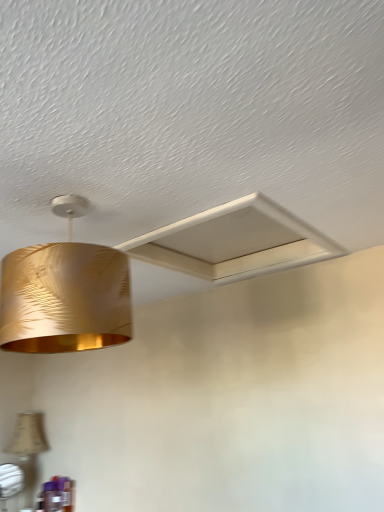
Question: Does white matte exhaust hood at upper center have a greater width compared to beige fabric lampshade at lower left, the first lamp ordered from the bottom?

Choices:
 (A) no
 (B) yes

Answer: (B)

Question: Is white matte exhaust hood at upper center facing towards beige fabric lampshade at lower left, which is the first lamp in back-to-front order?

Choices:
 (A) no
 (B) yes

Answer: (A)

Question: Is white matte exhaust hood at upper center directly adjacent to beige fabric lampshade at lower left, which is the first lamp in back-to-front order?

Choices:
 (A) yes
 (B) no

Answer: (B)

Question: Is white matte exhaust hood at upper center turned away from beige fabric lampshade at lower left, placed as the second lamp when sorted from top to bottom?

Choices:
 (A) yes
 (B) no

Answer: (B)

Question: Is white matte exhaust hood at upper center to the left of beige fabric lampshade at lower left, the first lamp ordered from the bottom, from the viewer's perspective?

Choices:
 (A) yes
 (B) no

Answer: (B)

Question: Is white matte exhaust hood at upper center bigger than beige fabric lampshade at lower left, which is the first lamp in back-to-front order?

Choices:
 (A) no
 (B) yes

Answer: (A)

Question: Is gold metallic lampshade at upper left, which appears as the 2th lamp when viewed from the left, further to the viewer compared to white matte exhaust hood at upper center?

Choices:
 (A) no
 (B) yes

Answer: (A)

Question: Can you confirm if gold metallic lampshade at upper left, the 1th lamp viewed from the right, is positioned to the right of white matte exhaust hood at upper center?

Choices:
 (A) yes
 (B) no

Answer: (B)

Question: From the image's perspective, is gold metallic lampshade at upper left, which appears as the 2th lamp when viewed from the left, on top of white matte exhaust hood at upper center?

Choices:
 (A) yes
 (B) no

Answer: (B)

Question: Can white matte exhaust hood at upper center be found inside gold metallic lampshade at upper left, which ranks as the second lamp in back-to-front order?

Choices:
 (A) no
 (B) yes

Answer: (A)

Question: From a real-world perspective, is gold metallic lampshade at upper left, the 1th lamp when ordered from front to back, under white matte exhaust hood at upper center?

Choices:
 (A) no
 (B) yes

Answer: (B)

Question: Can you confirm if gold metallic lampshade at upper left, the 1th lamp viewed from the right, is smaller than white matte exhaust hood at upper center?

Choices:
 (A) no
 (B) yes

Answer: (A)

Question: From a real-world perspective, does beige fabric lampshade at lower left, acting as the 2th lamp starting from the right, stand above gold metallic lampshade at upper left, which is the second lamp in bottom-to-top order?

Choices:
 (A) no
 (B) yes

Answer: (A)